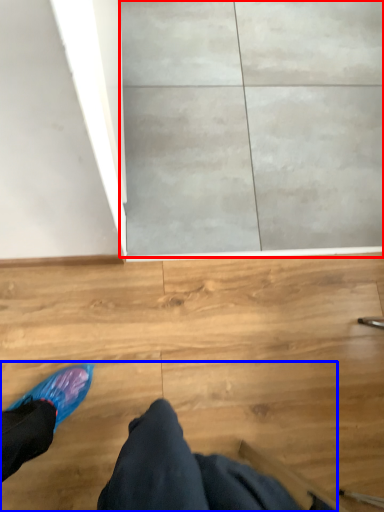
Question: Which point is further to the camera, concrete (highlighted by a red box) or person (highlighted by a blue box)?

Choices:
 (A) concrete
 (B) person

Answer: (A)